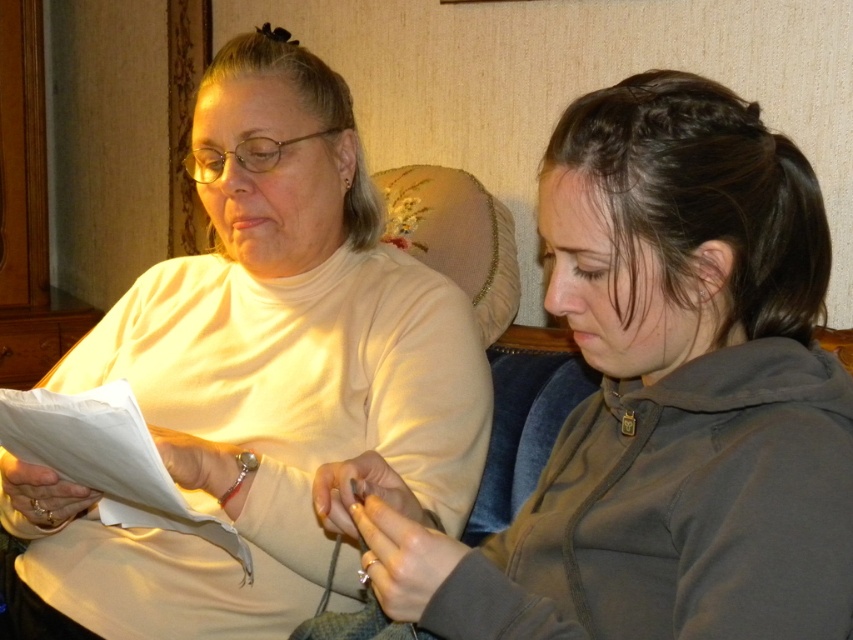
Can you confirm if matte white sweater at center is positioned above white paper at left?

Indeed, matte white sweater at center is positioned over white paper at left.

Between point (302, 160) and point (148, 435), which one is positioned behind?

The point (302, 160) is more distant.

This screenshot has height=640, width=853. In order to click on matte white sweater at center in this screenshot , I will do `click(257, 374)`.

Is matte gray hoodie at right wider than white paper at left?

Correct, the width of matte gray hoodie at right exceeds that of white paper at left.

How distant is matte gray hoodie at right from white paper at left?

matte gray hoodie at right is 15.38 inches away from white paper at left.

What do you see at coordinates (656, 401) in the screenshot? Image resolution: width=853 pixels, height=640 pixels. I see `matte gray hoodie at right` at bounding box center [656, 401].

Image resolution: width=853 pixels, height=640 pixels. Identify the location of matte gray hoodie at right. [656, 401].

Is point (630, 230) positioned after point (322, 323)?

No, (630, 230) is closer to viewer.

Does matte gray hoodie at right have a smaller size compared to matte white sweater at center?

Yes, matte gray hoodie at right is smaller than matte white sweater at center.

Does point (582, 116) come closer to viewer compared to point (218, 465)?

Yes.

Identify the location of matte gray hoodie at right. The image size is (853, 640). (656, 401).